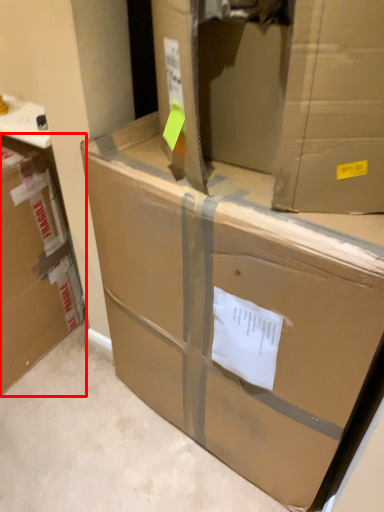
Question: From the image's perspective, what is the correct spatial positioning of box (annotated by the red box) in reference to box?

Choices:
 (A) below
 (B) above

Answer: (B)